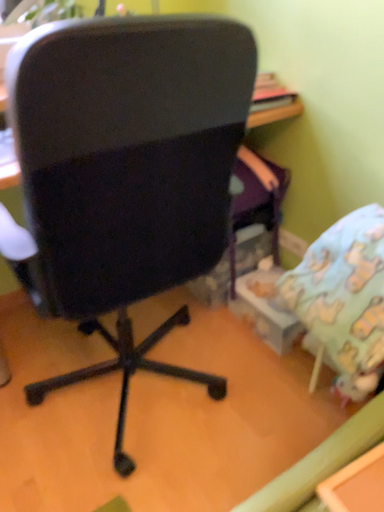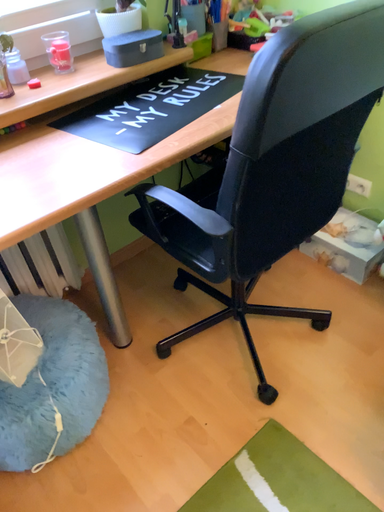
Question: How did the camera likely rotate when shooting the video?

Choices:
 (A) rotated upward
 (B) rotated downward

Answer: (B)